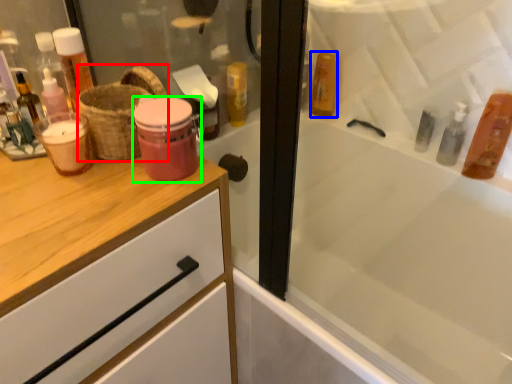
Question: Which object is the farthest from basket (highlighted by a red box)? Choose among these: mouthwash (highlighted by a blue box) or mouthwash (highlighted by a green box).

Choices:
 (A) mouthwash
 (B) mouthwash

Answer: (A)